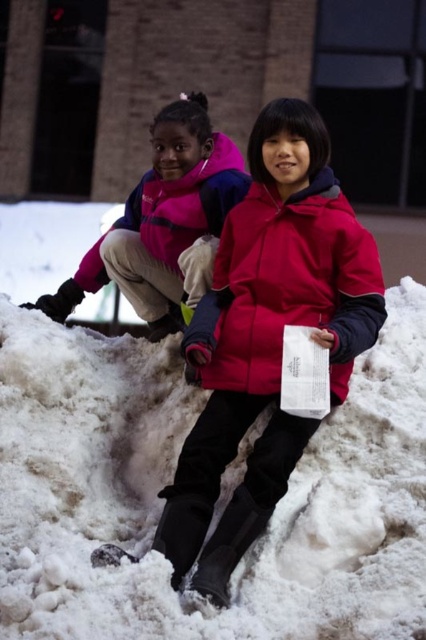
Is white fluffy snow at center further to the viewer compared to matte red jacket at center?

→ No, white fluffy snow at center is in front of matte red jacket at center.

Between white fluffy snow at center and matte red jacket at center, which one is positioned lower?

matte red jacket at center

Where is `white fluffy snow at center`? This screenshot has height=640, width=426. white fluffy snow at center is located at coordinates (172, 476).

Is white fluffy snow at center bigger than matte pink jacket at upper left?

Yes, white fluffy snow at center is bigger than matte pink jacket at upper left.

Does white fluffy snow at center have a greater height compared to matte pink jacket at upper left?

Incorrect, white fluffy snow at center's height is not larger of matte pink jacket at upper left's.

Between point (307, 484) and point (178, 112), which one is positioned in front?

Point (307, 484) is more forward.

At what (x,y) coordinates should I click in order to perform the action: click on white fluffy snow at center. Please return your answer as a coordinate pair (x, y). Looking at the image, I should click on (172, 476).

Between matte red jacket at center and matte pink jacket at upper left, which one is positioned higher?

matte pink jacket at upper left is above.

Does matte red jacket at center have a lesser width compared to matte pink jacket at upper left?

Yes.

Who is more forward, (268, 291) or (170, 118)?

Point (268, 291)

The height and width of the screenshot is (640, 426). In order to click on matte red jacket at center in this screenshot , I will do `click(287, 289)`.